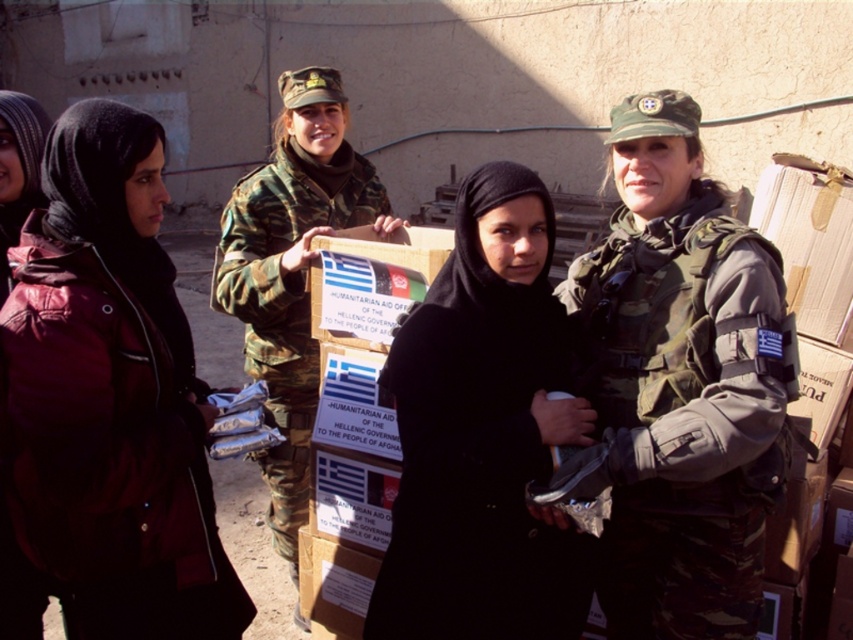
Who is positioned more to the right, matte black jacket at left or matte red jacket at left?

Positioned to the right is matte black jacket at left.

Who is more distant from viewer, (73, 241) or (3, 147)?

The point (3, 147) is behind.

What are the coordinates of `matte black jacket at left` in the screenshot? It's located at point(109,397).

Who is taller, camo fabric vest at center or matte red jacket at left?

Standing taller between the two is camo fabric vest at center.

Does camo fabric vest at center have a larger size compared to matte red jacket at left?

Correct, camo fabric vest at center is larger in size than matte red jacket at left.

Does point (637, 586) come in front of point (33, 602)?

Yes, it is.

You are a GUI agent. You are given a task and a screenshot of the screen. Output one action in this format:
    pyautogui.click(x=<x>, y=<y>)
    Task: Click on the camo fabric vest at center
    The width and height of the screenshot is (853, 640).
    Given the screenshot: What is the action you would take?
    pyautogui.click(x=685, y=413)

Does matte black jacket at left appear under camouflage fabric uniform at center?

Yes, matte black jacket at left is below camouflage fabric uniform at center.

Which of these two, matte black jacket at left or camouflage fabric uniform at center, stands taller?

Standing taller between the two is camouflage fabric uniform at center.

What do you see at coordinates (109, 397) in the screenshot? The image size is (853, 640). I see `matte black jacket at left` at bounding box center [109, 397].

Identify the location of matte black jacket at left. (109, 397).